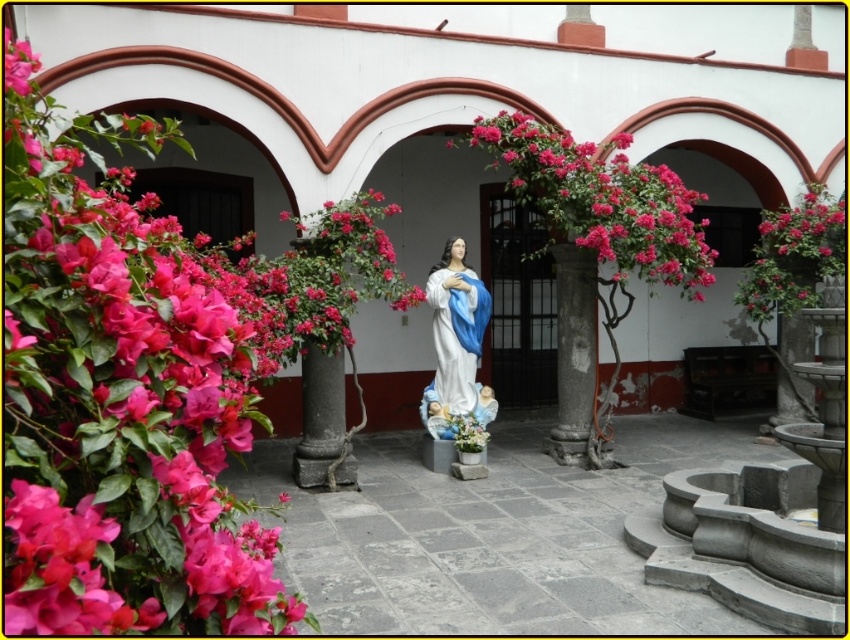
You are standing in the courtyard and want to take a closer look at the flowers. Which of the two flower groups, the matte pink flowers at left or the pink glossy flowers at center, would you need to walk towards if you want to get the closest to the flowers without moving your feet?

The matte pink flowers at left are closer to the viewer, so you would need to walk towards them to get closer without moving your feet.

You are an artist planning to paint the courtyard scene. You want to ensure the proportions between the matte pink flowers at left and the white glossy statue at center are accurate. Which object should you paint as taller?

The white glossy statue at center is taller than the matte pink flowers at left, so you should paint the white glossy statue at center as taller.

You are standing in the courtyard and want to place a small bench exactly at the point specified in the image. The bench is 0.2 meters wide. Can you place it at point point (119, 400) without overlapping the matte pink flowers at left?

The matte pink flowers at left is located at point (119, 400), so placing the bench there would overlap with the flowers. Choose another location.